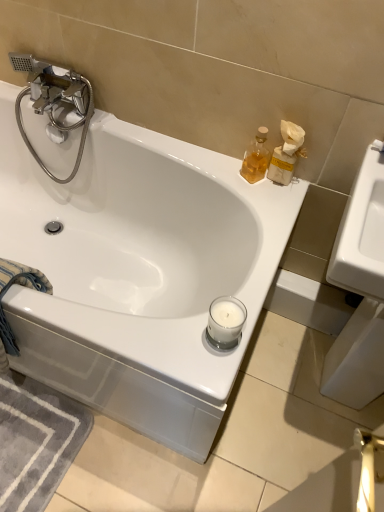
Locate an element on the screen. Image resolution: width=384 pixels, height=512 pixels. unoccupied area in front of translucent glass soap dispenser at upper right is located at coordinates (263, 204).